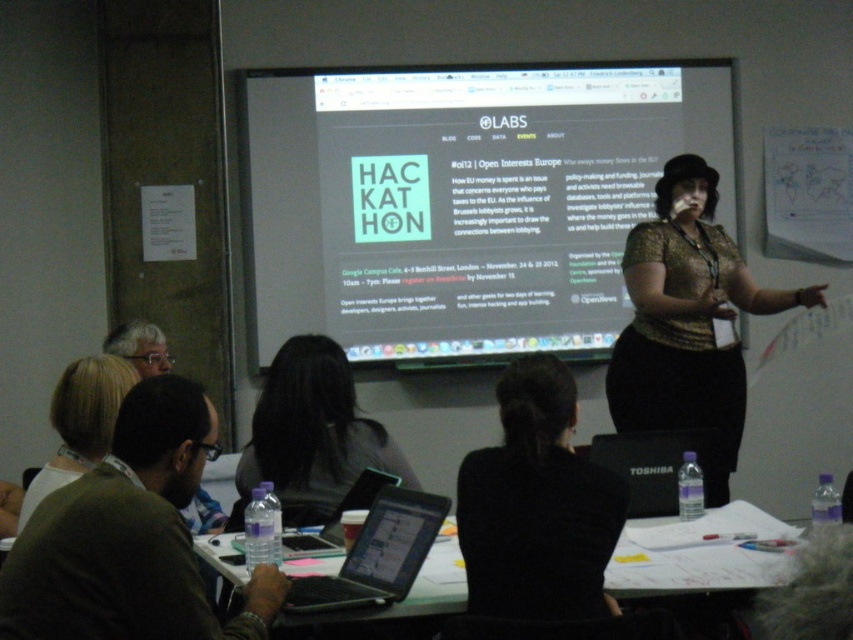
Question: Can you confirm if white glossy projection screen at upper center is thinner than black glossy laptop at center?

Choices:
 (A) yes
 (B) no

Answer: (B)

Question: Estimate the real-world distances between objects in this image. Which object is farther from the black glossy laptop at center?

Choices:
 (A) blonde hair at lower left
 (B) dark brown hair at center

Answer: (A)

Question: Estimate the real-world distances between objects in this image. Which object is farther from the black fabric hair at center?

Choices:
 (A) black glossy laptop at center
 (B) white glossy projection screen at upper center
 (C) gold textured blouse at center
 (D) blonde hair at lower left

Answer: (B)

Question: Can you confirm if white glossy projection screen at upper center is positioned above black fabric hair at center?

Choices:
 (A) yes
 (B) no

Answer: (A)

Question: Is gold textured blouse at center below dark brown hair at center?

Choices:
 (A) yes
 (B) no

Answer: (B)

Question: Which object is the closest to the black glossy laptop at center?

Choices:
 (A) blonde hair at lower left
 (B) dark brown hair at center
 (C) gold textured blouse at center
 (D) white glossy projection screen at upper center

Answer: (B)